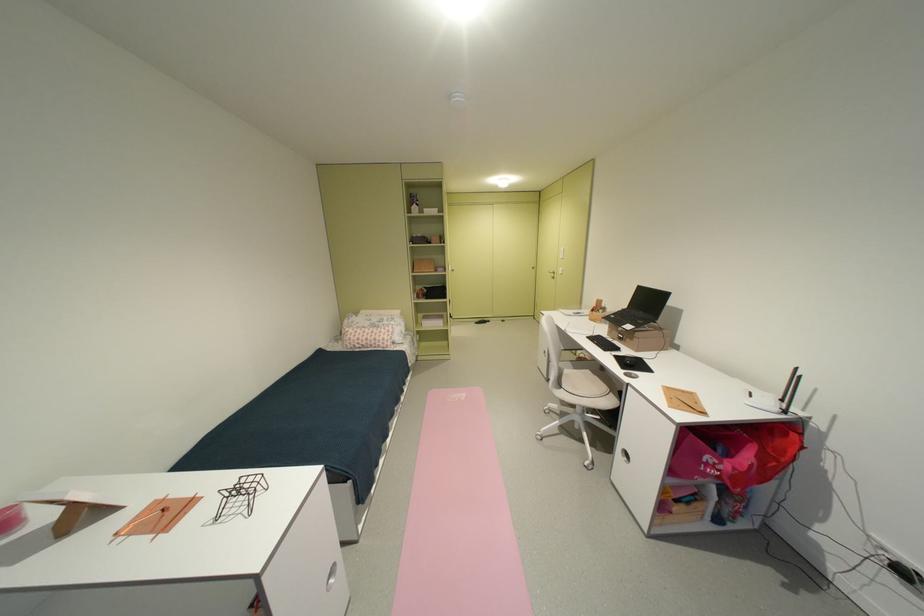
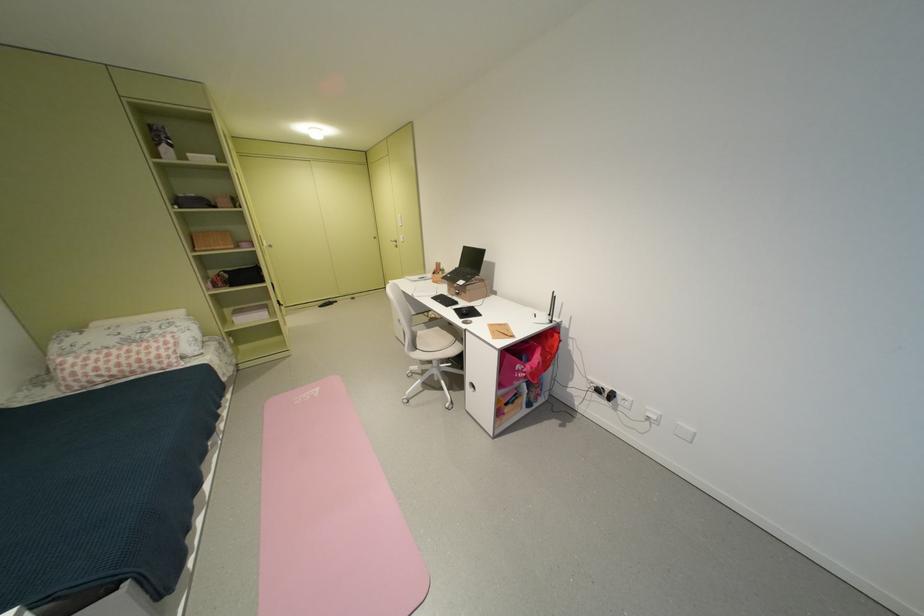
Locate, in the second image, the point that corresponds to point (614, 352) in the first image.

(456, 307)